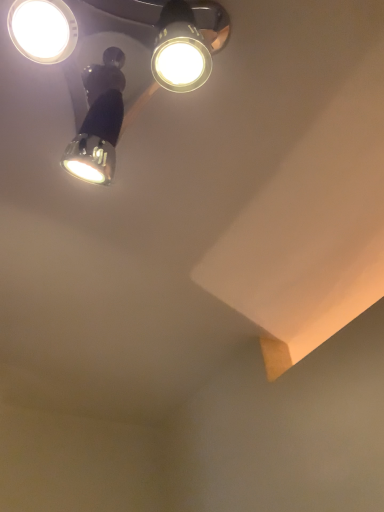
The width and height of the screenshot is (384, 512). Describe the element at coordinates (117, 62) in the screenshot. I see `metallic silver spotlight at upper left` at that location.

I want to click on metallic silver spotlight at upper left, so tap(117, 62).

Identify the location of metallic silver spotlight at upper left. The image size is (384, 512). click(x=117, y=62).